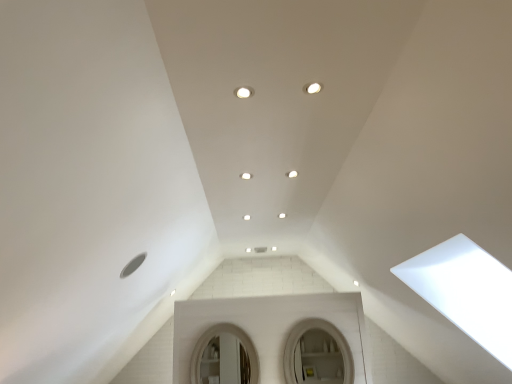
Question: In terms of height, does white glossy mirror at center, the second mirror in the left-to-right sequence, look taller or shorter compared to white glossy light fixture at center?

Choices:
 (A) tall
 (B) short

Answer: (A)

Question: Is white glossy mirror at center, the second mirror in the left-to-right sequence, spatially inside white glossy light fixture at center, or outside of it?

Choices:
 (A) inside
 (B) outside

Answer: (B)

Question: Considering the real-world distances, which object is closest to the white glossy light fixture at center?

Choices:
 (A) white matte mirror at center, which is counted as the first mirror, starting from the left
 (B) white glossy mirror at center, positioned as the 1th mirror in right-to-left order

Answer: (B)

Question: Which object is positioned farthest from the white glossy mirror at center, positioned as the 1th mirror in right-to-left order?

Choices:
 (A) white matte mirror at center, which is counted as the first mirror, starting from the left
 (B) white glossy light fixture at center

Answer: (B)